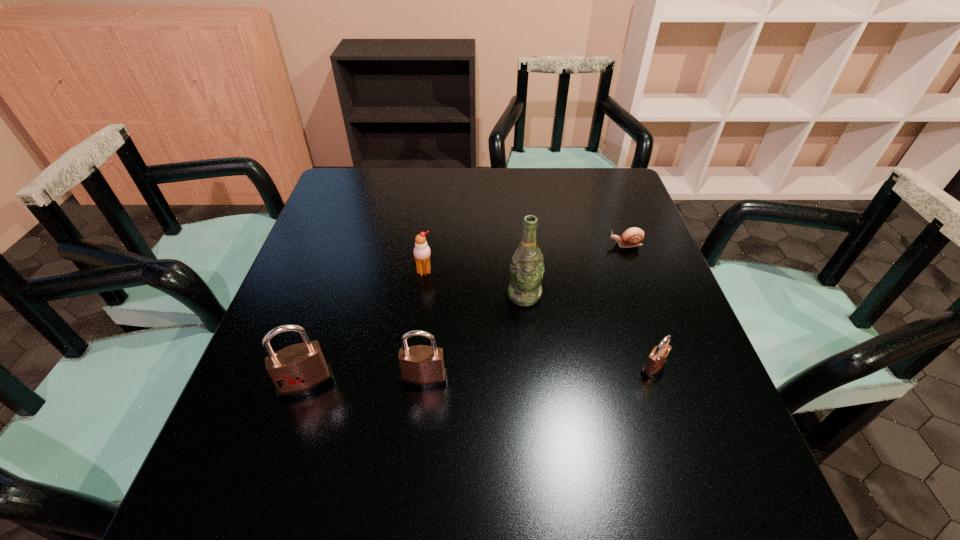
The height and width of the screenshot is (540, 960). I want to click on empty space that is in between the fourth nearest object and the second padlock from left to right, so click(x=474, y=338).

At what (x,y) coordinates should I click in order to perform the action: click on free space between the second shortest object and the leftmost object. Please return your answer as a coordinate pair (x, y). The height and width of the screenshot is (540, 960). Looking at the image, I should click on (480, 376).

Identify the location of unoccupied area between the rightmost padlock and the third object from right to left. (588, 332).

Locate an element on the screen. This screenshot has height=540, width=960. empty location between the leftmost padlock and the second padlock from left to right is located at coordinates (366, 381).

The height and width of the screenshot is (540, 960). I want to click on vacant area that lies between the second tallest padlock and the leftmost padlock, so click(x=366, y=381).

This screenshot has width=960, height=540. Identify the location of unoccupied area between the rightmost padlock and the fourth tallest object. (539, 320).

What are the coordinates of `blank region between the tallest object and the second tallest padlock` in the screenshot? It's located at (474, 338).

Image resolution: width=960 pixels, height=540 pixels. I want to click on object that can be found as the fourth closest to the third farthest object, so click(632, 237).

Point out which object is positioned as the third nearest to the fifth tallest object. Please provide its 2D coordinates. Your answer should be formatted as a tuple, i.e. [(x, y)], where the tuple contains the x and y coordinates of a point satisfying the conditions above.

[(422, 366)]

Identify which padlock is located as the second nearest to the leftmost padlock. Please provide its 2D coordinates. Your answer should be formatted as a tuple, i.e. [(x, y)], where the tuple contains the x and y coordinates of a point satisfying the conditions above.

[(657, 359)]